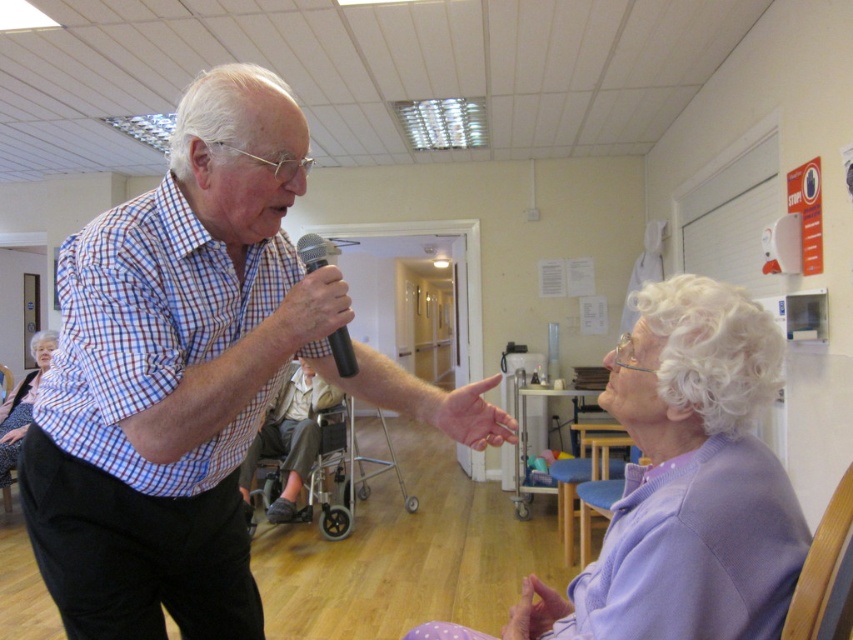
Question: Can you confirm if blue checkered shirt at upper left is positioned to the right of metallic gray wheelchair at center?

Choices:
 (A) no
 (B) yes

Answer: (B)

Question: Estimate the real-world distances between objects in this image. Which object is farther from the bamboo chair at lower right?

Choices:
 (A) black matte microphone at upper center
 (B) blue checkered shirt at upper left
 (C) purple fabric at lower right
 (D) light purple sweater at lower right

Answer: (D)

Question: Does purple fabric at lower right have a larger size compared to blue fabric chair at lower right?

Choices:
 (A) yes
 (B) no

Answer: (B)

Question: Can you confirm if purple fabric at lower right is thinner than metallic gray wheelchair at center?

Choices:
 (A) yes
 (B) no

Answer: (A)

Question: Based on their relative distances, which object is farther from the purple fabric at lower right?

Choices:
 (A) blue fabric chair at lower right
 (B) black matte microphone at upper center
 (C) metallic gray wheelchair at center
 (D) bamboo chair at lower right

Answer: (C)

Question: Which object is the farthest from the black matte microphone at upper center?

Choices:
 (A) metallic gray wheelchair at center
 (B) blue checkered shirt at upper left
 (C) blue fabric chair at lower right

Answer: (A)